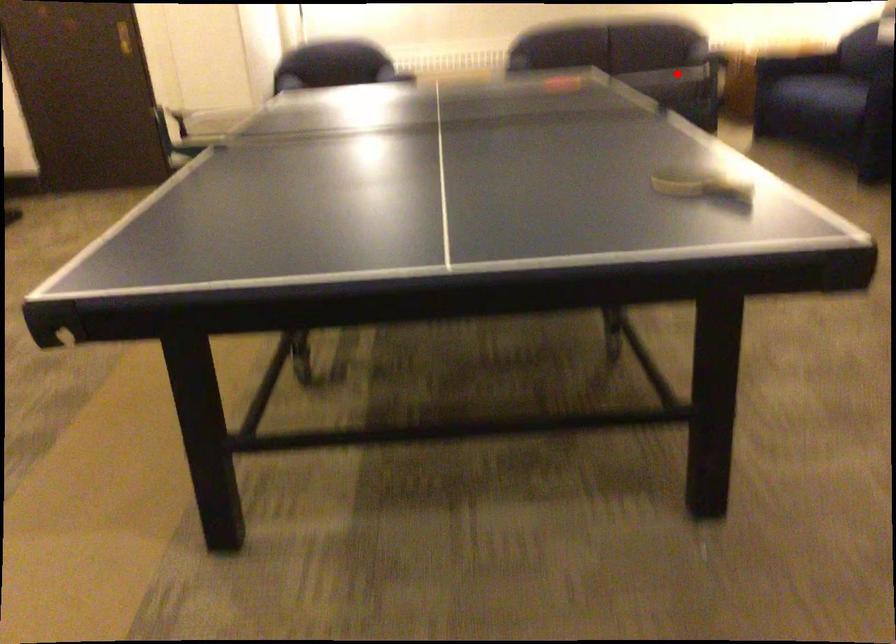
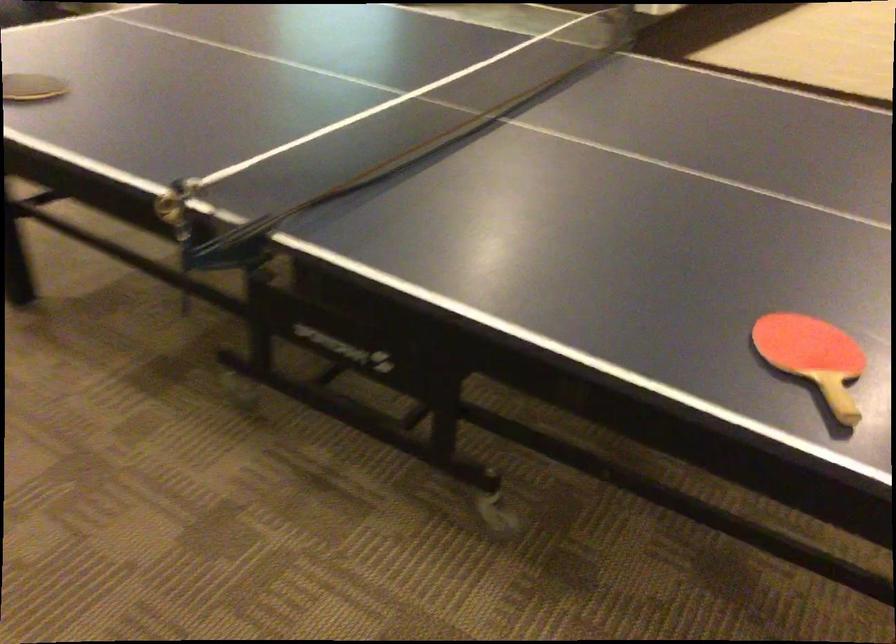
Question: I am providing you with two images of the same scene from different viewpoints. A red point is shown in image1. For the corresponding object point in image2, is it positioned nearer or farther from the camera?

Choices:
 (A) Nearer
 (B) Farther

Answer: (A)